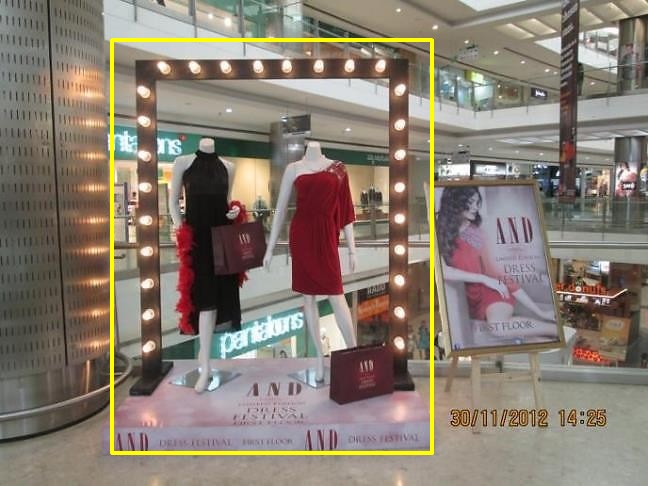
Locate an element on the screen. The height and width of the screenshot is (486, 648). gift bag is located at coordinates (343, 378).